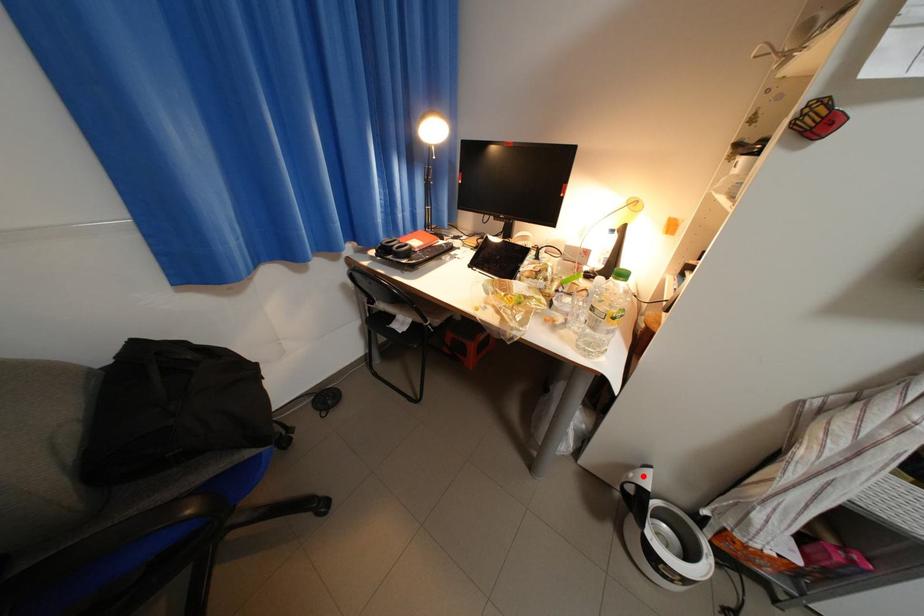
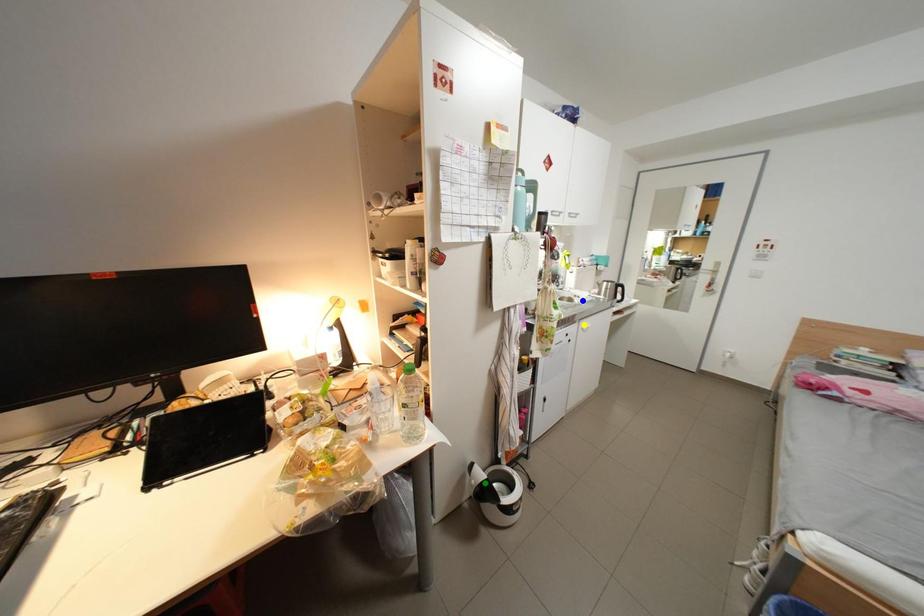
Question: I am providing you with two images of the same scene from different viewpoints. A red point is marked on the first image. You are given multiple points on the second image. Which mark in image 2 goes with the point in image 1?

Choices:
 (A) green point
 (B) blue point
 (C) yellow point

Answer: (A)